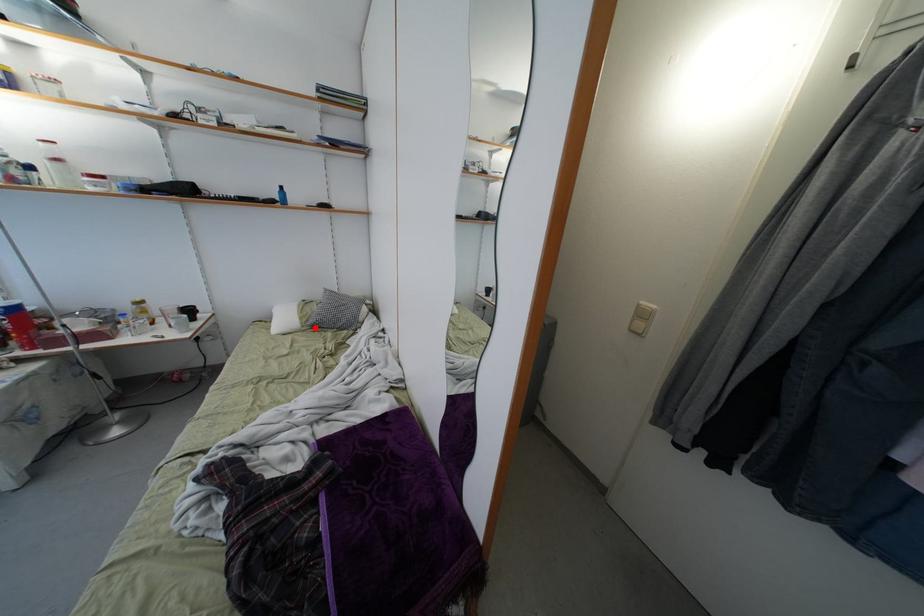
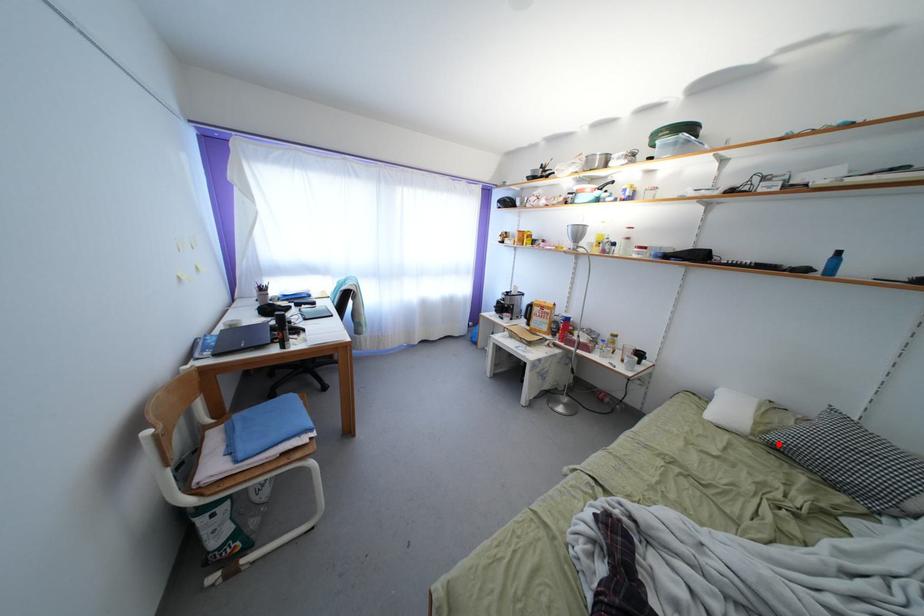
I am providing you with two images of the same scene from different viewpoints. A red point is marked on the first image and another point is marked on the second image. Is the red point in image1 aligned with the point shown in image2?

Yes